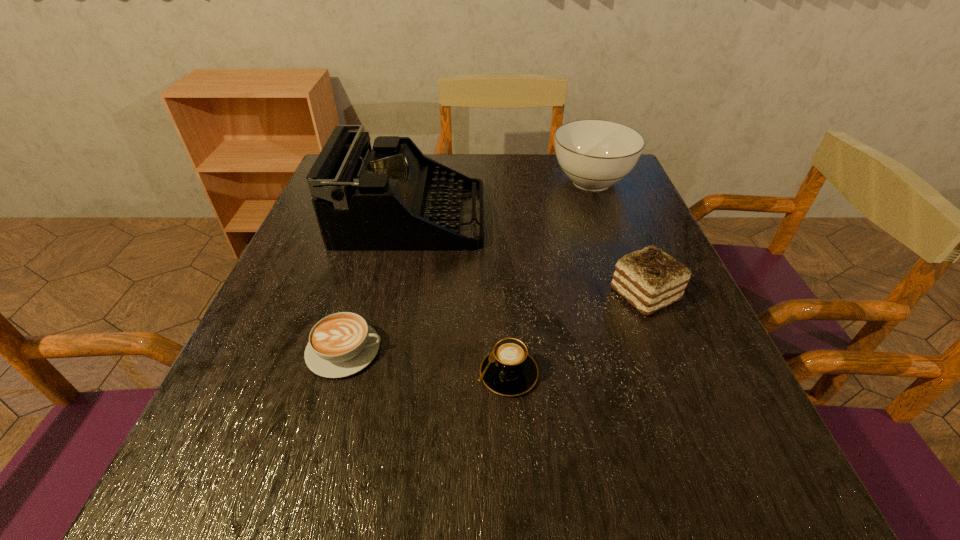
Where is `vacant space that satisfies the following two spatial constraints: 1. on the typing side of the typewriter; 2. on the back side of the right cappuccino`? This screenshot has height=540, width=960. vacant space that satisfies the following two spatial constraints: 1. on the typing side of the typewriter; 2. on the back side of the right cappuccino is located at coordinates (379, 374).

Locate an element on the screen. The image size is (960, 540). free region that satisfies the following two spatial constraints: 1. on the back side of the taller cappuccino; 2. on the side of the shorter cappuccino with the handle is located at coordinates (507, 350).